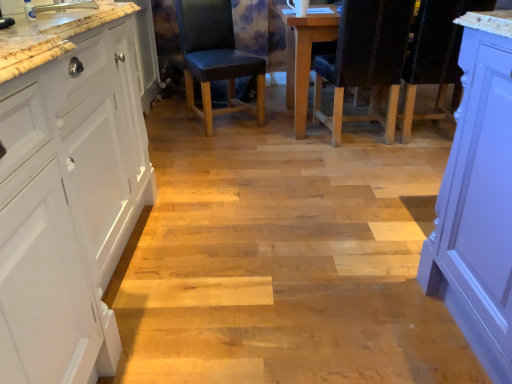
Identify the location of free location to the left of black leather chair at center, arranged as the first chair when viewed from the right. 284,141.